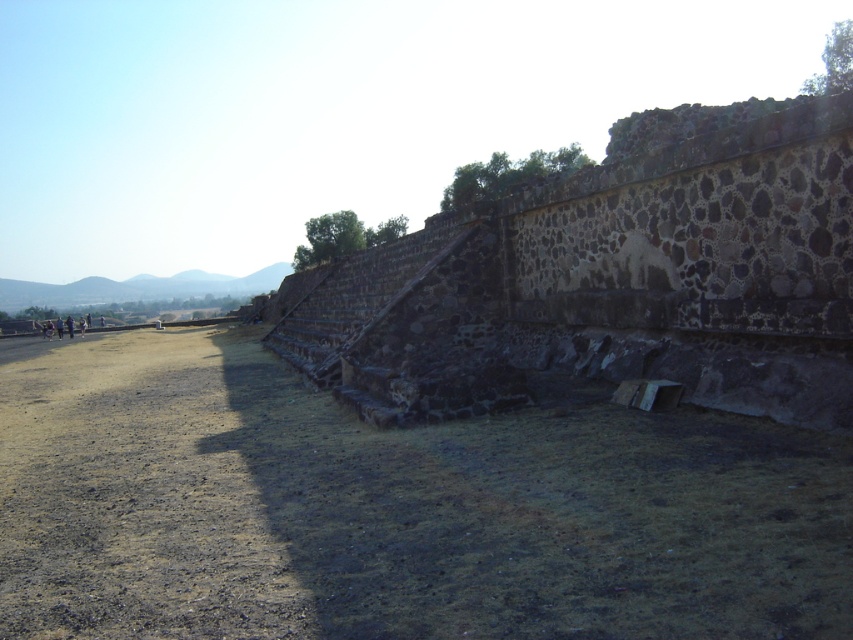
You are a hiker carrying a heavy backpack and need to reach the rustic stone stairs at center from the brown dirt track at lower left. The path between them is 7.36 meters. Can you safely walk this distance with your load?

The distance between rustic stone stairs at center and brown dirt track at lower left is 7.36 meters. Since this is a manageable distance for a hiker with a heavy backpack, you can safely walk this path.

You are standing at the base of the ancient stone steps and want to take a photo of the two points marked in the image. Which point, point [257,500] or point [776,154], will appear larger in your camera view?

Point [257,500] will appear larger in your camera view because it is closer to the camera than point [776,154].